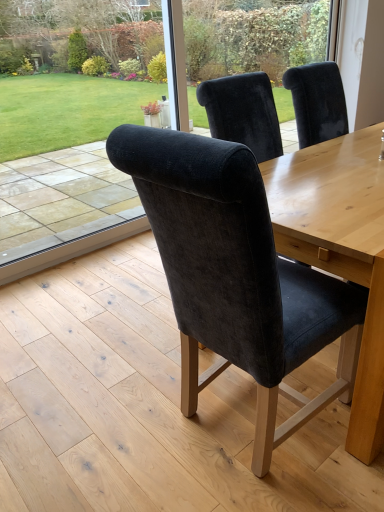
Image resolution: width=384 pixels, height=512 pixels. In order to click on free region on the left part of velvet dark blue chair at center in this screenshot , I will do pyautogui.click(x=109, y=417).